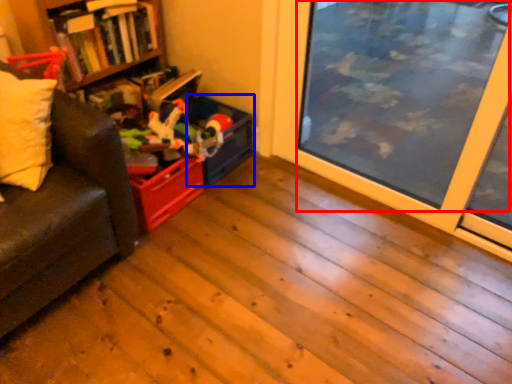
Question: Among these objects, which one is nearest to the camera, window screen (highlighted by a red box) or storage box (highlighted by a blue box)?

Choices:
 (A) window screen
 (B) storage box

Answer: (A)